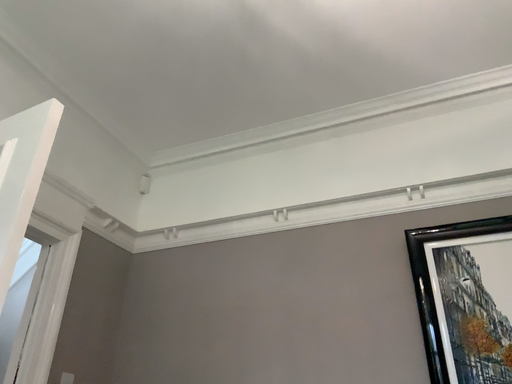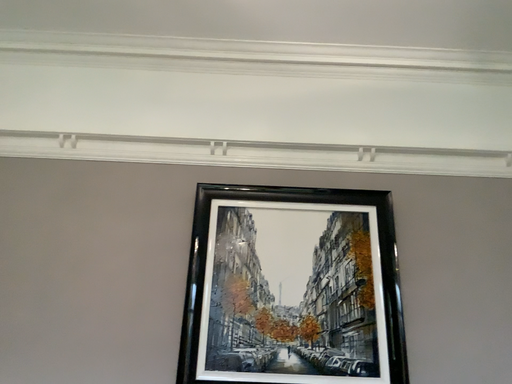
Question: Which way did the camera rotate in the video?

Choices:
 (A) rotated upward
 (B) rotated downward

Answer: (B)